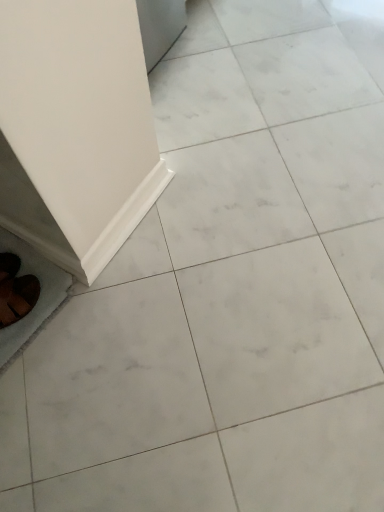
The width and height of the screenshot is (384, 512). I want to click on free spot to the right of brown suede shoes at lower left, so click(43, 308).